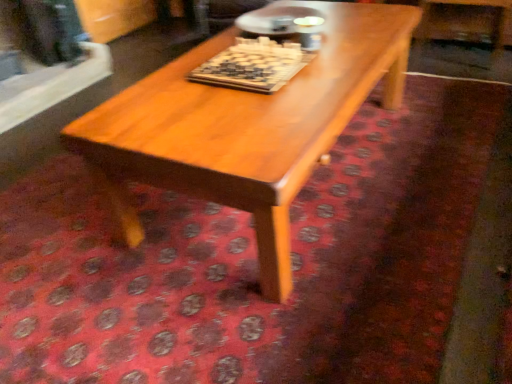
What do you see at coordinates (245, 128) in the screenshot? Image resolution: width=512 pixels, height=384 pixels. I see `light brown wood coffee table at center` at bounding box center [245, 128].

What is the approximate height of light brown wood coffee table at center?

The height of light brown wood coffee table at center is 19.96 inches.

Identify the location of light brown wood coffee table at center. This screenshot has height=384, width=512. (245, 128).

This screenshot has width=512, height=384. What do you see at coordinates (254, 65) in the screenshot?
I see `wooden chessboard at center` at bounding box center [254, 65].

You are a GUI agent. You are given a task and a screenshot of the screen. Output one action in this format:
    pyautogui.click(x=<x>, y=<y>)
    Task: Click on the wooden chessboard at center
    Image resolution: width=512 pixels, height=384 pixels.
    Given the screenshot: What is the action you would take?
    pyautogui.click(x=254, y=65)

I want to click on light brown wood coffee table at center, so click(245, 128).

Is light brown wood coffee table at center at the left side of wooden chessboard at center?

Incorrect, light brown wood coffee table at center is not on the left side of wooden chessboard at center.

Which is in front, light brown wood coffee table at center or wooden chessboard at center?

light brown wood coffee table at center is closer to the camera.

Which is less distant, (209, 109) or (266, 51)?

The point (209, 109) is closer to the camera.

From the image's perspective, is light brown wood coffee table at center located beneath wooden chessboard at center?

Correct, light brown wood coffee table at center appears lower than wooden chessboard at center in the image.

From a real-world perspective, which object stands above the other?

wooden chessboard at center, from a real-world perspective.

Which object is thinner, light brown wood coffee table at center or wooden chessboard at center?

wooden chessboard at center is thinner.

Consider the image. Considering the relative sizes of light brown wood coffee table at center and wooden chessboard at center in the image provided, is light brown wood coffee table at center taller than wooden chessboard at center?

Correct, light brown wood coffee table at center is much taller as wooden chessboard at center.

Between light brown wood coffee table at center and wooden chessboard at center, which one has smaller size?

Smaller between the two is wooden chessboard at center.

Based on the photo, would you say light brown wood coffee table at center is outside wooden chessboard at center?

light brown wood coffee table at center lies outside wooden chessboard at center's area.

Is light brown wood coffee table at center directly adjacent to wooden chessboard at center?

They are not placed beside each other.

Is light brown wood coffee table at center aimed at wooden chessboard at center?

No, light brown wood coffee table at center is not oriented towards wooden chessboard at center.

How many degrees apart are the facing directions of light brown wood coffee table at center and wooden chessboard at center?

1.49 degrees separate the facing orientations of light brown wood coffee table at center and wooden chessboard at center.

Measure the distance from light brown wood coffee table at center to wooden chessboard at center.

light brown wood coffee table at center and wooden chessboard at center are 10.88 inches apart.

Find the location of a particular element. board game above the light brown wood coffee table at center (from a real-world perspective) is located at coordinates (254, 65).

Considering the positions of objects wooden chessboard at center and light brown wood coffee table at center in the image provided, who is more to the right, wooden chessboard at center or light brown wood coffee table at center?

light brown wood coffee table at center is more to the right.

Considering the positions of objects wooden chessboard at center and light brown wood coffee table at center in the image provided, who is behind, wooden chessboard at center or light brown wood coffee table at center?

wooden chessboard at center.

Is point (241, 49) in front of point (322, 151)?

That is False.

From the image's perspective, which is below, wooden chessboard at center or light brown wood coffee table at center?

light brown wood coffee table at center is shown below in the image.

From a real-world perspective, does wooden chessboard at center sit lower than light brown wood coffee table at center?

No.

Is wooden chessboard at center thinner than light brown wood coffee table at center?

Indeed, wooden chessboard at center has a lesser width compared to light brown wood coffee table at center.

Who is taller, wooden chessboard at center or light brown wood coffee table at center?

light brown wood coffee table at center is taller.

Based on their sizes in the image, would you say wooden chessboard at center is bigger or smaller than light brown wood coffee table at center?

In the image, wooden chessboard at center appears to be smaller than light brown wood coffee table at center.

Is light brown wood coffee table at center a part of wooden chessboard at center?

No, light brown wood coffee table at center is not a part of wooden chessboard at center.

Is wooden chessboard at center far away from light brown wood coffee table at center?

No, wooden chessboard at center is in close proximity to light brown wood coffee table at center.

Is wooden chessboard at center facing towards light brown wood coffee table at center?

No, wooden chessboard at center is not oriented towards light brown wood coffee table at center.

The width and height of the screenshot is (512, 384). Find the location of `coffee table lying in front of the wooden chessboard at center`. coffee table lying in front of the wooden chessboard at center is located at coordinates (245, 128).

I want to click on board game above the light brown wood coffee table at center (from a real-world perspective), so click(x=254, y=65).

The height and width of the screenshot is (384, 512). What are the coordinates of `coffee table that appears below the wooden chessboard at center (from a real-world perspective)` in the screenshot? It's located at (245, 128).